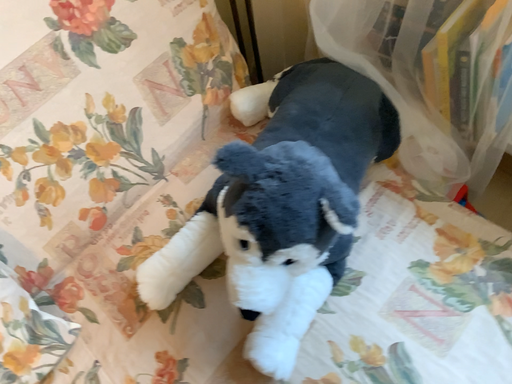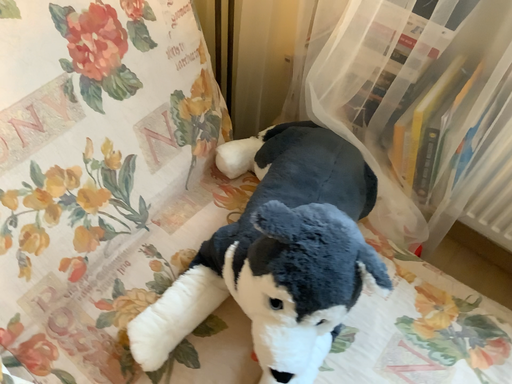
Question: How did the camera likely rotate when shooting the video?

Choices:
 (A) rotated left
 (B) rotated right

Answer: (B)